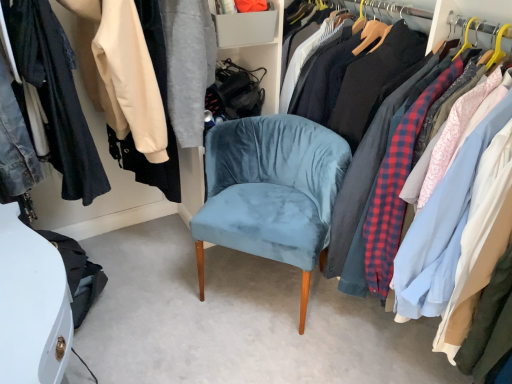
In order to click on vacant space that is to the left of velvet blue chair at center in this screenshot , I will do `click(157, 292)`.